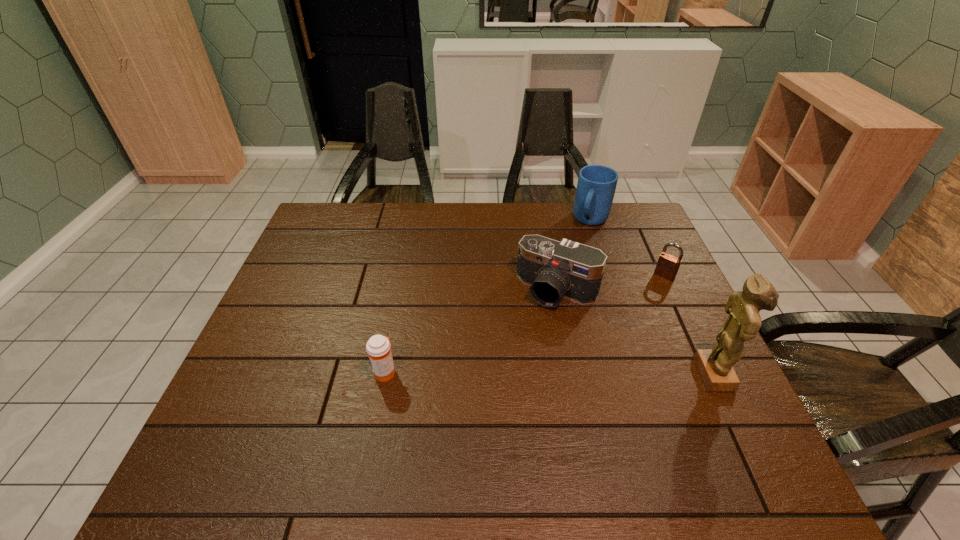
Where is `free space located 0.360m on the side of the second tallest object with the handle`? This screenshot has height=540, width=960. free space located 0.360m on the side of the second tallest object with the handle is located at coordinates (553, 305).

Locate an element on the screen. blank space located on the side of the second tallest object with the handle is located at coordinates (578, 254).

You are a GUI agent. You are given a task and a screenshot of the screen. Output one action in this format:
    pyautogui.click(x=<x>, y=<y>)
    Task: Click on the vacant space located 0.100m on the side of the second tallest object with the handle
    
    Given the screenshot: What is the action you would take?
    pyautogui.click(x=579, y=251)

This screenshot has width=960, height=540. In order to click on free spot located on the front-facing side of the padlock in this screenshot , I will do `click(633, 318)`.

This screenshot has width=960, height=540. Find the location of `free space located on the front-facing side of the padlock`. free space located on the front-facing side of the padlock is located at coordinates tap(651, 293).

I want to click on free location located on the front-facing side of the padlock, so click(x=625, y=329).

Identify the location of object that is at the far edge. Image resolution: width=960 pixels, height=540 pixels. (596, 186).

The width and height of the screenshot is (960, 540). Find the location of `figurine present at the right edge`. figurine present at the right edge is located at coordinates (715, 366).

Locate an element on the screen. Image resolution: width=960 pixels, height=540 pixels. mug at the right edge is located at coordinates (596, 186).

I want to click on padlock that is at the right edge, so click(x=667, y=266).